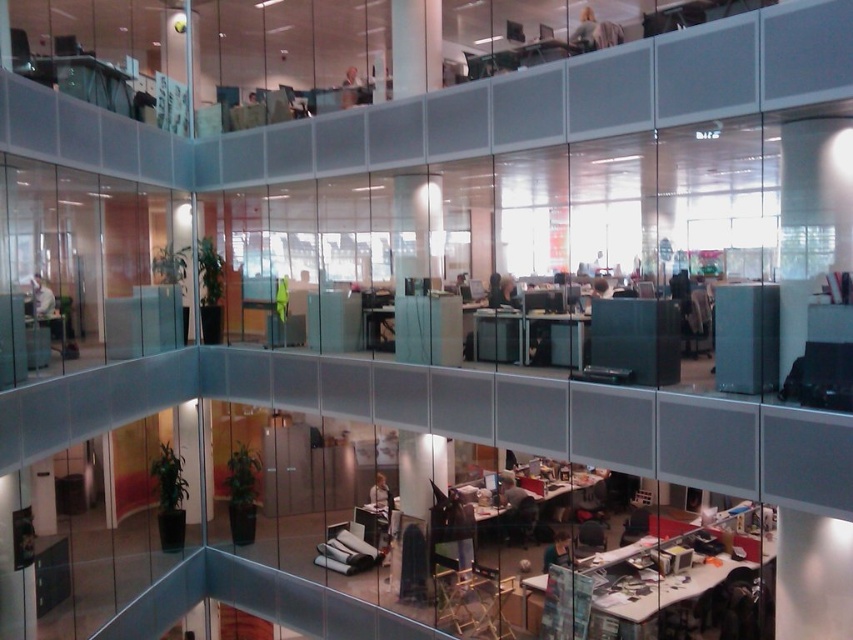
You are standing on the balcony overlooking the office. You notice two points marked in the scene. Which point is closer to you, point (585, 493) or point (577, 545)?

Point (585, 493) is closer to you because it is further to the viewer than point (577, 545).

You are an office worker who needs to choose between the matte black chair at lower center and the metallic gray chair at lower right for a task requiring a narrower seat. Which chair should you choose?

The matte black chair at lower center is thinner than the metallic gray chair at lower right, so you should choose the matte black chair at lower center for the narrower seat requirement.

You are standing on the balcony overlooking the office and want to move from the metallic silver chair at lower center to the metallic gray chair at lower right. Which chair will you reach first if you walk straight towards them?

You will reach the metallic silver chair at lower center first because it is closer to you than the metallic gray chair at lower right, which is further away.